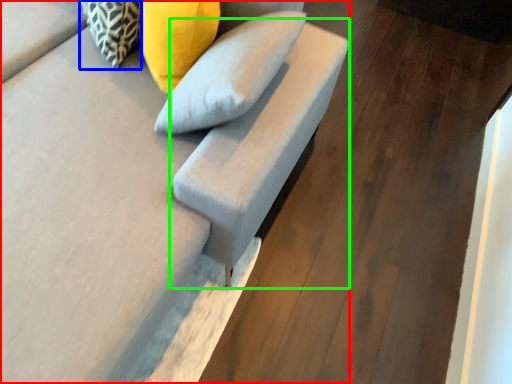
Question: Estimate the real-world distances between objects in this image. Which object is closer to furniture (highlighted by a red box), pillow (highlighted by a blue box) or armchair (highlighted by a green box)?

Choices:
 (A) pillow
 (B) armchair

Answer: (B)